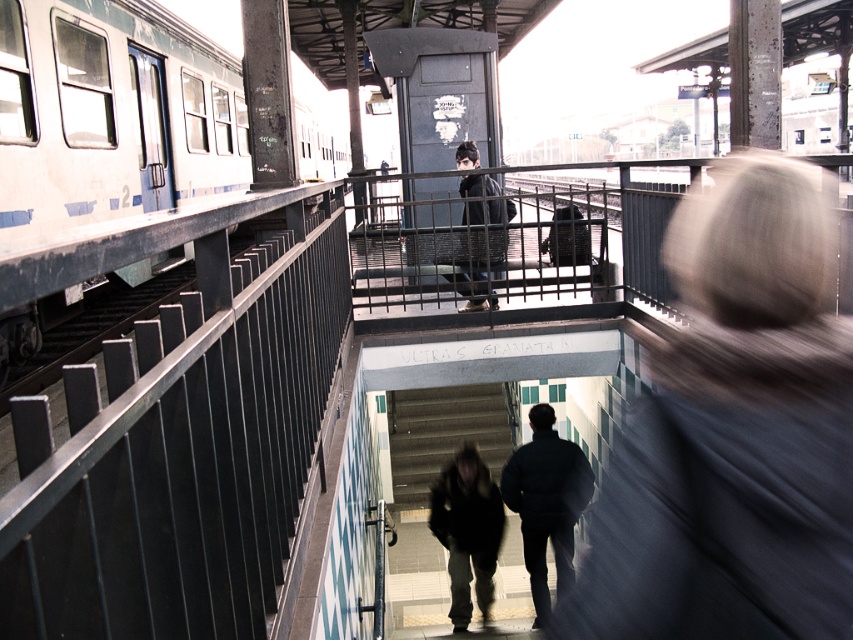
You are a passenger at the train station and notice the blurred gray hair at upper right and the white painted metal train at left. Which object is located to the right of the other?

The blurred gray hair at upper right is positioned on the right side of white painted metal train at left.